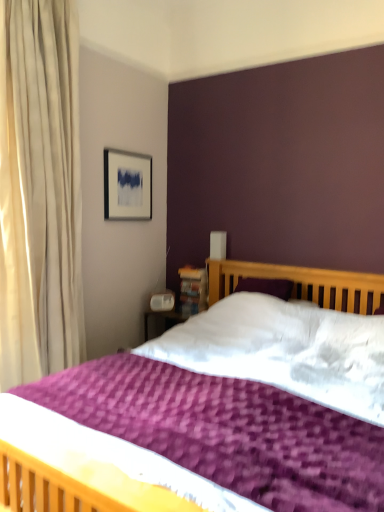
Question: Is wooden bookshelf at upper right beside matte silver picture frame at upper left?

Choices:
 (A) no
 (B) yes

Answer: (A)

Question: From a real-world perspective, is wooden bookshelf at upper right over matte silver picture frame at upper left?

Choices:
 (A) yes
 (B) no

Answer: (B)

Question: Considering the relative positions of wooden bookshelf at upper right and matte silver picture frame at upper left in the image provided, is wooden bookshelf at upper right to the left of matte silver picture frame at upper left from the viewer's perspective?

Choices:
 (A) no
 (B) yes

Answer: (A)

Question: Considering the relative sizes of wooden bookshelf at upper right and matte silver picture frame at upper left in the image provided, is wooden bookshelf at upper right bigger than matte silver picture frame at upper left?

Choices:
 (A) no
 (B) yes

Answer: (A)

Question: From a real-world perspective, is wooden bookshelf at upper right under matte silver picture frame at upper left?

Choices:
 (A) yes
 (B) no

Answer: (A)

Question: Considering the relative sizes of wooden bookshelf at upper right and matte silver picture frame at upper left in the image provided, is wooden bookshelf at upper right thinner than matte silver picture frame at upper left?

Choices:
 (A) yes
 (B) no

Answer: (B)

Question: Is purple textured bed at center positioned behind wooden bookshelf at upper right?

Choices:
 (A) no
 (B) yes

Answer: (A)

Question: Is purple textured bed at center shorter than wooden bookshelf at upper right?

Choices:
 (A) no
 (B) yes

Answer: (A)

Question: Is purple textured bed at center bigger than wooden bookshelf at upper right?

Choices:
 (A) yes
 (B) no

Answer: (A)

Question: Is purple textured bed at center positioned with its back to wooden bookshelf at upper right?

Choices:
 (A) no
 (B) yes

Answer: (A)

Question: From the image's perspective, would you say purple textured bed at center is shown under wooden bookshelf at upper right?

Choices:
 (A) yes
 (B) no

Answer: (A)

Question: Is purple textured bed at center not close to wooden bookshelf at upper right?

Choices:
 (A) yes
 (B) no

Answer: (A)

Question: Considering the relative sizes of purple textured bed at center and matte silver picture frame at upper left in the image provided, is purple textured bed at center bigger than matte silver picture frame at upper left?

Choices:
 (A) no
 (B) yes

Answer: (B)